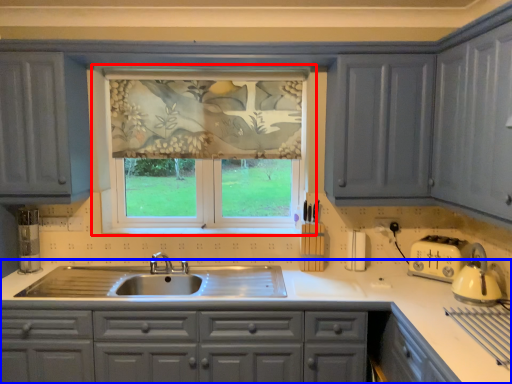
Question: Which of the following is the closest to the observer, window (highlighted by a red box) or countertop (highlighted by a blue box)?

Choices:
 (A) window
 (B) countertop

Answer: (B)